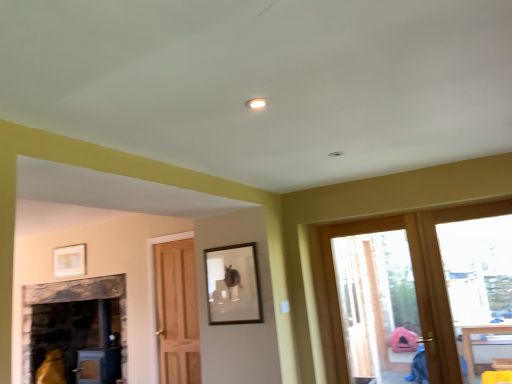
Question: Is matte white picture frame at upper left, the 2th picture frame viewed from the right, located within transparent glass door at right, the first window from the left?

Choices:
 (A) no
 (B) yes

Answer: (A)

Question: Does transparent glass door at right, the first window from the left, have a greater height compared to matte white picture frame at upper left, which is counted as the 1th picture frame, starting from the left?

Choices:
 (A) yes
 (B) no

Answer: (A)

Question: Is transparent glass door at right, acting as the second window starting from the right, facing towards matte white picture frame at upper left, which is counted as the 1th picture frame, starting from the left?

Choices:
 (A) yes
 (B) no

Answer: (B)

Question: Does transparent glass door at right, the first window from the left, appear on the right side of matte white picture frame at upper left, placed as the first picture frame when sorted from back to front?

Choices:
 (A) yes
 (B) no

Answer: (A)

Question: Does transparent glass door at right, acting as the second window starting from the right, have a smaller size compared to matte white picture frame at upper left, placed as the first picture frame when sorted from back to front?

Choices:
 (A) no
 (B) yes

Answer: (A)

Question: Is point (248, 314) positioned closer to the camera than point (482, 317)?

Choices:
 (A) closer
 (B) farther

Answer: (B)

Question: Is matte black picture frame at center, the first picture frame viewed from the right, wider or thinner than clear glass door at right, positioned as the 1th window in right-to-left order?

Choices:
 (A) thin
 (B) wide

Answer: (A)

Question: Looking at the image, does matte black picture frame at center, which ranks as the 2th picture frame in left-to-right order, seem bigger or smaller compared to clear glass door at right, which is the 2th window in left-to-right order?

Choices:
 (A) big
 (B) small

Answer: (B)

Question: Visually, is matte black picture frame at center, the first picture frame viewed from the right, positioned to the left or to the right of clear glass door at right, which is the 2th window in left-to-right order?

Choices:
 (A) right
 (B) left

Answer: (B)

Question: Choose the correct answer: Is clear glass door at right, which is the 2th window in left-to-right order, inside matte white picture frame at upper left, placed as the first picture frame when sorted from back to front, or outside it?

Choices:
 (A) inside
 (B) outside

Answer: (B)

Question: From a real-world perspective, is clear glass door at right, positioned as the 1th window in right-to-left order, positioned above or below matte white picture frame at upper left, which is counted as the 1th picture frame, starting from the left?

Choices:
 (A) above
 (B) below

Answer: (B)

Question: In terms of size, does clear glass door at right, which is the 2th window in left-to-right order, appear bigger or smaller than matte white picture frame at upper left, the 2th picture frame viewed from the right?

Choices:
 (A) small
 (B) big

Answer: (B)

Question: Is point (495, 354) positioned closer to the camera than point (80, 266)?

Choices:
 (A) farther
 (B) closer

Answer: (B)

Question: Based on their sizes in the image, would you say matte white picture frame at upper left, the 2th picture frame viewed from the right, is bigger or smaller than matte black picture frame at center, the second picture frame from the back?

Choices:
 (A) big
 (B) small

Answer: (B)

Question: Is matte white picture frame at upper left, which is counted as the 1th picture frame, starting from the left, wider or thinner than matte black picture frame at center, the second picture frame from the back?

Choices:
 (A) thin
 (B) wide

Answer: (A)